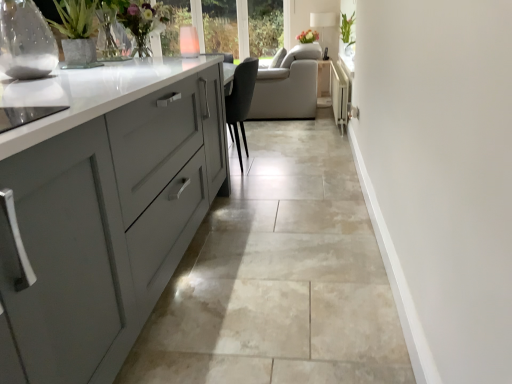
In the scene shown: Measure the distance between white fabric lampshade at upper center and camera.

They are 16.74 feet apart.

What do you see at coordinates (349, 50) in the screenshot?
I see `clear glass vase at center, which is the first glass vase from right to left` at bounding box center [349, 50].

This screenshot has width=512, height=384. I want to click on green glossy plant at upper right, so click(x=347, y=29).

The image size is (512, 384). Describe the element at coordinates (279, 277) in the screenshot. I see `beige tile floor at center` at that location.

This screenshot has height=384, width=512. Describe the element at coordinates (308, 36) in the screenshot. I see `white matte floral arrangement at upper center, arranged as the first floral arrangement when viewed from the back` at that location.

In the scene shown: How much space does translucent glass vase at upper left, which ranks as the second floral arrangement in back-to-front order, occupy horizontally?

The width of translucent glass vase at upper left, which ranks as the second floral arrangement in back-to-front order, is 12.87 inches.

What are the coordinates of `white fabric lampshade at upper center` in the screenshot? It's located at (326, 30).

Is white fabric lampshade at upper center completely or partially outside of green glossy plant at upper right?

Absolutely, white fabric lampshade at upper center is external to green glossy plant at upper right.

Consider the image. From a real-world perspective, is white fabric lampshade at upper center on top of green glossy plant at upper right?

Incorrect, from a real-world perspective, white fabric lampshade at upper center is lower than green glossy plant at upper right.

Consider the image. Is white fabric lampshade at upper center not near green glossy plant at upper right?

Yes, white fabric lampshade at upper center and green glossy plant at upper right are located far from each other.

Could you tell me if white fabric lampshade at upper center is turned towards green glossy plant at upper right?

No, white fabric lampshade at upper center is not oriented towards green glossy plant at upper right.

Would you say translucent glass vase at upper left, which ranks as the first floral arrangement in bottom-to-top order, is outside white fabric lampshade at upper center?

Indeed, translucent glass vase at upper left, which ranks as the first floral arrangement in bottom-to-top order, is completely outside white fabric lampshade at upper center.

From the white fabric lampshade at upper center, count the 2nd floral arrangement to the left and point to it. Please provide its 2D coordinates.

[(114, 20)]

Are translucent glass vase at upper left, which ranks as the 2th floral arrangement in top-to-bottom order, and white fabric lampshade at upper center beside each other?

No, translucent glass vase at upper left, which ranks as the 2th floral arrangement in top-to-bottom order, is not touching white fabric lampshade at upper center.

From a real-world perspective, is translucent glass vase at upper left, which ranks as the second floral arrangement in back-to-front order, on top of white fabric lampshade at upper center?

Yes, from a real-world perspective, translucent glass vase at upper left, which ranks as the second floral arrangement in back-to-front order, is over white fabric lampshade at upper center

Can you confirm if white matte floral arrangement at upper center, marked as the 2th floral arrangement in a front-to-back arrangement, is positioned to the right of translucent glass vase at upper left, which is the 1th floral arrangement in left-to-right order?

Yes, white matte floral arrangement at upper center, marked as the 2th floral arrangement in a front-to-back arrangement, is to the right of translucent glass vase at upper left, which is the 1th floral arrangement in left-to-right order.

Is white matte floral arrangement at upper center, the 1th floral arrangement positioned from the right, positioned with its back to translucent glass vase at upper left, which ranks as the 2th floral arrangement in top-to-bottom order?

No, translucent glass vase at upper left, which ranks as the 2th floral arrangement in top-to-bottom order, is not at the back of white matte floral arrangement at upper center, the 1th floral arrangement positioned from the right.

From a real-world perspective, is white matte floral arrangement at upper center, the second floral arrangement from the left, positioned over translucent glass vase at upper left, which is the 1th floral arrangement in left-to-right order, based on gravity?

No, from a real-world perspective, white matte floral arrangement at upper center, the second floral arrangement from the left, is not over translucent glass vase at upper left, which is the 1th floral arrangement in left-to-right order

Based on the photo, which is behind, green glossy plant at upper right or white matte floral arrangement at upper center, the second floral arrangement from the left?

white matte floral arrangement at upper center, the second floral arrangement from the left, is further from the camera.

Is green glossy plant at upper right looking in the opposite direction of white matte floral arrangement at upper center, marked as the first floral arrangement in a top-to-bottom arrangement?

No.

Is green glossy plant at upper right situated inside white matte floral arrangement at upper center, marked as the first floral arrangement in a top-to-bottom arrangement, or outside?

green glossy plant at upper right is not inside white matte floral arrangement at upper center, marked as the first floral arrangement in a top-to-bottom arrangement, it's outside.

Considering the positions of point (343, 40) and point (311, 33), is point (343, 40) closer or farther from the camera than point (311, 33)?

Point (343, 40) is closer to the camera than point (311, 33).

From a real-world perspective, is beige tile floor at center on top of green glossy plant at upper right?

No, from a real-world perspective, beige tile floor at center is not over green glossy plant at upper right

Is beige tile floor at center positioned with its back to green glossy plant at upper right?

No, beige tile floor at center is not facing away from green glossy plant at upper right.

From the picture: Between beige tile floor at center and green glossy plant at upper right, which one has less height?

Standing shorter between the two is beige tile floor at center.

From the picture: Is beige tile floor at center placed right next to green glossy plant at upper right?

No, beige tile floor at center is not touching green glossy plant at upper right.

Between point (379, 302) and point (62, 16), which one is positioned behind?

The point (62, 16) is farther.

Is beige tile floor at center with translucent glass vase at upper left, which ranks as the 2th floral arrangement in top-to-bottom order?

beige tile floor at center and translucent glass vase at upper left, which ranks as the 2th floral arrangement in top-to-bottom order, are clearly separated.

Would you say beige tile floor at center is outside translucent glass vase at upper left, which ranks as the first floral arrangement in bottom-to-top order?

Absolutely, beige tile floor at center is external to translucent glass vase at upper left, which ranks as the first floral arrangement in bottom-to-top order.

Considering the sizes of objects beige tile floor at center and translucent glass vase at upper left, which ranks as the second floral arrangement in back-to-front order, in the image provided, who is wider, beige tile floor at center or translucent glass vase at upper left, which ranks as the second floral arrangement in back-to-front order,?

Wider between the two is beige tile floor at center.

Measure the distance between translucent glass vase at upper left, the 2th floral arrangement when ordered from right to left, and clear glass vase at center, positioned as the second glass vase in left-to-right order.

translucent glass vase at upper left, the 2th floral arrangement when ordered from right to left, is 6.16 feet away from clear glass vase at center, positioned as the second glass vase in left-to-right order.

From the image's perspective, which one is positioned lower, translucent glass vase at upper left, the 1th floral arrangement in the front-to-back sequence, or clear glass vase at center, which appears as the second glass vase when ordered from the bottom?

translucent glass vase at upper left, the 1th floral arrangement in the front-to-back sequence, from the image's perspective.

Consider the image. Which is behind, translucent glass vase at upper left, the 2th floral arrangement when ordered from right to left, or clear glass vase at center, positioned as the second glass vase in left-to-right order?

Positioned behind is clear glass vase at center, positioned as the second glass vase in left-to-right order.

Is point (106, 36) positioned behind point (347, 53)?

No, (106, 36) is closer to viewer.

Image resolution: width=512 pixels, height=384 pixels. In order to click on plant in front of the white fabric lampshade at upper center in this screenshot , I will do 347,29.

You are a GUI agent. You are given a task and a screenshot of the screen. Output one action in this format:
    pyautogui.click(x=<x>, y=<y>)
    Task: Click on the light that appears behind the translucent glass vase at upper left, which ranks as the first floral arrangement in bottom-to-top order
    
    Given the screenshot: What is the action you would take?
    pyautogui.click(x=326, y=30)

Considering their positions, is beige tile floor at center positioned closer to clear glass vase at upper left, positioned as the 1th glass vase in left-to-right order, than white fabric lampshade at upper center?

beige tile floor at center.

Estimate the real-world distances between objects in this image. Which object is closer to beige tile floor at center, white matte floral arrangement at upper center, marked as the 2th floral arrangement in a front-to-back arrangement, or clear glass vase at upper left, the 2th glass vase from the top?

clear glass vase at upper left, the 2th glass vase from the top, lies closer to beige tile floor at center than the other object.

Looking at the image, which one is located further to clear glass vase at center, which is the first glass vase from right to left, clear glass vase at upper left, the 2th glass vase positioned from the right, or beige tile floor at center?

Based on the image, clear glass vase at upper left, the 2th glass vase positioned from the right, appears to be further to clear glass vase at center, which is the first glass vase from right to left.

When comparing their distances from beige tile floor at center, does translucent glass vase at upper left, the 2th floral arrangement when ordered from right to left, or white fabric lampshade at upper center seem further?

Based on the image, white fabric lampshade at upper center appears to be further to beige tile floor at center.

When comparing their distances from green glossy plant at upper right, does clear glass vase at upper left, marked as the first glass vase in a front-to-back arrangement, or white matte floral arrangement at upper center, the 1th floral arrangement positioned from the right, seem further?

Among the two, clear glass vase at upper left, marked as the first glass vase in a front-to-back arrangement, is located further to green glossy plant at upper right.

From the image, which object appears to be farther from green glossy plant at upper right, white fabric lampshade at upper center or beige tile floor at center?

beige tile floor at center.

Which object lies further to the anchor point green glossy plant at upper right, clear glass vase at center, which is the 1th glass vase from top to bottom, or clear glass vase at upper left, positioned as the 1th glass vase in left-to-right order?

clear glass vase at upper left, positioned as the 1th glass vase in left-to-right order, is positioned further to the anchor green glossy plant at upper right.

Looking at the image, which one is located closer to clear glass vase at upper left, the 2th glass vase from the back, translucent glass vase at upper left, which ranks as the 2th floral arrangement in top-to-bottom order, or green glossy plant at upper right?

translucent glass vase at upper left, which ranks as the 2th floral arrangement in top-to-bottom order, is positioned closer to the anchor clear glass vase at upper left, the 2th glass vase from the back.

Where is `glass vase positioned between clear glass vase at upper left, positioned as the 1th glass vase in left-to-right order, and white matte floral arrangement at upper center, the second floral arrangement from the left, from near to far`? glass vase positioned between clear glass vase at upper left, positioned as the 1th glass vase in left-to-right order, and white matte floral arrangement at upper center, the second floral arrangement from the left, from near to far is located at coordinates [349, 50].

In order to click on glass vase located between beige tile floor at center and translucent glass vase at upper left, the 1th floral arrangement in the front-to-back sequence, in the depth direction in this screenshot , I will do `click(25, 41)`.

This screenshot has width=512, height=384. What are the coordinates of `floral arrangement between green glossy plant at upper right and white fabric lampshade at upper center from front to back` in the screenshot? It's located at (308, 36).

Image resolution: width=512 pixels, height=384 pixels. I want to click on floral arrangement between beige tile floor at center and white matte floral arrangement at upper center, marked as the first floral arrangement in a top-to-bottom arrangement, in the front-back direction, so click(114, 20).